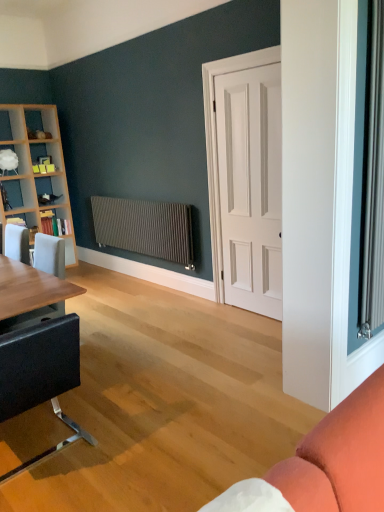
Locate an element on the screen. This screenshot has width=384, height=512. wooden bookshelf at left, arranged as the 2th shelf when viewed from the top is located at coordinates (54, 223).

Describe the element at coordinates (54, 223) in the screenshot. This screenshot has height=512, width=384. I see `wooden bookshelf at left, which is counted as the second shelf, starting from the bottom` at that location.

Where is `matte metallic radiator at center`? This screenshot has width=384, height=512. matte metallic radiator at center is located at coordinates (145, 228).

What do you see at coordinates (145, 228) in the screenshot?
I see `matte metallic radiator at center` at bounding box center [145, 228].

The width and height of the screenshot is (384, 512). Identify the location of wooden bookshelf at left, the first shelf in the bottom-to-top sequence. (23, 225).

Identify the location of wooden bookshelf at left, which is counted as the second shelf, starting from the bottom. (54, 223).

Find the location of a particular element. The image size is (384, 512). the 1st shelf behind the matte black table at left, counting from the anchor's position is located at coordinates click(x=12, y=160).

Considering the relative positions of matte black table at left and white glossy shelf at upper left, which appears as the 1th shelf when viewed from the top, in the image provided, is matte black table at left to the right of white glossy shelf at upper left, which appears as the 1th shelf when viewed from the top, from the viewer's perspective?

Yes, matte black table at left is to the right of white glossy shelf at upper left, which appears as the 1th shelf when viewed from the top.

What's the angular difference between matte black table at left and white glossy shelf at upper left, which is the third shelf in bottom-to-top order,'s facing directions?

The angle between the facing direction of matte black table at left and the facing direction of white glossy shelf at upper left, which is the third shelf in bottom-to-top order, is 87.2 degrees.

Considering the sizes of objects matte black table at left and white glossy shelf at upper left, which is the third shelf in bottom-to-top order, in the image provided, who is shorter, matte black table at left or white glossy shelf at upper left, which is the third shelf in bottom-to-top order,?

white glossy shelf at upper left, which is the third shelf in bottom-to-top order.

Where is `studio couch on the right of wooden bookshelf at left, arranged as the 2th shelf when viewed from the top`? The width and height of the screenshot is (384, 512). studio couch on the right of wooden bookshelf at left, arranged as the 2th shelf when viewed from the top is located at coordinates (325, 464).

How far apart are wooden bookshelf at left, arranged as the 2th shelf when viewed from the top, and matte coral fabric couch at lower right?

A distance of 4.29 meters exists between wooden bookshelf at left, arranged as the 2th shelf when viewed from the top, and matte coral fabric couch at lower right.

From a real-world perspective, is wooden bookshelf at left, arranged as the 2th shelf when viewed from the top, on top of matte coral fabric couch at lower right?

Correct, in the physical world, wooden bookshelf at left, arranged as the 2th shelf when viewed from the top, is higher than matte coral fabric couch at lower right.

Are wooden bookshelf at left, which is counted as the second shelf, starting from the bottom, and matte coral fabric couch at lower right far apart?

Yes, wooden bookshelf at left, which is counted as the second shelf, starting from the bottom, is far from matte coral fabric couch at lower right.

Which is correct: white glossy shelf at upper left, which appears as the 1th shelf when viewed from the top, is inside matte metallic radiator at center, or outside of it?

white glossy shelf at upper left, which appears as the 1th shelf when viewed from the top, is not enclosed by matte metallic radiator at center.

Locate an element on the screen. radiator below the white glossy shelf at upper left, which is the third shelf in bottom-to-top order (from a real-world perspective) is located at coordinates tap(145, 228).

Measure the distance from white glossy shelf at upper left, which appears as the 1th shelf when viewed from the top, to matte metallic radiator at center.

They are 5.09 feet apart.

Looking at the image, does matte coral fabric couch at lower right seem bigger or smaller compared to wooden bookshelf at left, which is the third shelf in top-to-bottom order?

In the image, matte coral fabric couch at lower right appears to be larger than wooden bookshelf at left, which is the third shelf in top-to-bottom order.

Is the surface of matte coral fabric couch at lower right in direct contact with wooden bookshelf at left, which is the third shelf in top-to-bottom order?

matte coral fabric couch at lower right and wooden bookshelf at left, which is the third shelf in top-to-bottom order, are clearly separated.

Is matte coral fabric couch at lower right inside or outside of wooden bookshelf at left, the first shelf in the bottom-to-top sequence?

matte coral fabric couch at lower right lies outside wooden bookshelf at left, the first shelf in the bottom-to-top sequence.

How different are the orientations of matte coral fabric couch at lower right and wooden bookshelf at left, which is the third shelf in top-to-bottom order, in degrees?

179 degrees.

Considering the relative positions of wooden bookshelf at left, the first shelf in the bottom-to-top sequence, and wooden bookshelf at left, which is counted as the second shelf, starting from the bottom, in the image provided, is wooden bookshelf at left, the first shelf in the bottom-to-top sequence, behind wooden bookshelf at left, which is counted as the second shelf, starting from the bottom,?

That is False.

What's the angular difference between wooden bookshelf at left, the first shelf in the bottom-to-top sequence, and wooden bookshelf at left, which is counted as the second shelf, starting from the bottom,'s facing directions?

There is a 3.2-degree angle between the facing directions of wooden bookshelf at left, the first shelf in the bottom-to-top sequence, and wooden bookshelf at left, which is counted as the second shelf, starting from the bottom.

Is wooden bookshelf at left, which is the third shelf in top-to-bottom order, spatially inside wooden bookshelf at left, arranged as the 2th shelf when viewed from the top, or outside of it?

wooden bookshelf at left, which is the third shelf in top-to-bottom order, is not enclosed by wooden bookshelf at left, arranged as the 2th shelf when viewed from the top.

Is matte coral fabric couch at lower right not within black leather chair at lower left?

matte coral fabric couch at lower right is positioned outside black leather chair at lower left.

Between matte coral fabric couch at lower right and black leather chair at lower left, which one has smaller size?

matte coral fabric couch at lower right.

Could you tell me if matte coral fabric couch at lower right is facing black leather chair at lower left?

No, matte coral fabric couch at lower right is not facing towards black leather chair at lower left.

Is matte coral fabric couch at lower right touching black leather chair at lower left?

No.

Between black leather chair at lower left and matte coral fabric couch at lower right, which one has more height?

Standing taller between the two is black leather chair at lower left.

From a real-world perspective, between black leather chair at lower left and matte coral fabric couch at lower right, who is vertically lower?

In real-world perspective, matte coral fabric couch at lower right is lower.

Which point is more forward, (58, 389) or (369, 394)?

The point (369, 394) is closer.

Which shelf is the 1st one when counting from the back of the matte black table at left? Please provide its 2D coordinates.

[(12, 160)]

Locate an element on the screen. the 2nd shelf positioned above the matte coral fabric couch at lower right (from the image's perspective) is located at coordinates (54, 223).

Considering their positions, is black leather chair at lower left positioned further to wooden bookshelf at left, which is counted as the second shelf, starting from the bottom, than matte metallic radiator at center?

Among the two, black leather chair at lower left is located further to wooden bookshelf at left, which is counted as the second shelf, starting from the bottom.

Based on their spatial positions, is matte black table at left or matte metallic radiator at center closer to white glossy shelf at upper left, which appears as the 1th shelf when viewed from the top?

The object closer to white glossy shelf at upper left, which appears as the 1th shelf when viewed from the top, is matte metallic radiator at center.

Looking at the image, which one is located further to matte metallic radiator at center, white matte door at center or wooden bookshelf at left, the first shelf in the bottom-to-top sequence?

wooden bookshelf at left, the first shelf in the bottom-to-top sequence, is further to matte metallic radiator at center.

Based on their spatial positions, is white matte door at center or black leather chair at lower left further from matte coral fabric couch at lower right?

Among the two, white matte door at center is located further to matte coral fabric couch at lower right.

Estimate the real-world distances between objects in this image. Which object is closer to white glossy shelf at upper left, which is the third shelf in bottom-to-top order, matte coral fabric couch at lower right or matte black table at left?

Based on the image, matte black table at left appears to be nearer to white glossy shelf at upper left, which is the third shelf in bottom-to-top order.

Looking at the image, which one is located closer to wooden bookshelf at left, which is counted as the second shelf, starting from the bottom, matte metallic radiator at center or white matte door at center?

Among the two, matte metallic radiator at center is located nearer to wooden bookshelf at left, which is counted as the second shelf, starting from the bottom.

Based on their spatial positions, is black leather chair at lower left or white matte door at center closer to white glossy shelf at upper left, which appears as the 1th shelf when viewed from the top?

Among the two, white matte door at center is located nearer to white glossy shelf at upper left, which appears as the 1th shelf when viewed from the top.

Estimate the real-world distances between objects in this image. Which object is closer to wooden bookshelf at left, the first shelf in the bottom-to-top sequence, matte black table at left or matte metallic radiator at center?

Based on the image, matte black table at left appears to be nearer to wooden bookshelf at left, the first shelf in the bottom-to-top sequence.

Locate an element on the screen. radiator positioned between black leather chair at lower left and white glossy shelf at upper left, which is the third shelf in bottom-to-top order, from near to far is located at coordinates (145, 228).

Where is `table between matte coral fabric couch at lower right and matte metallic radiator at center in the front-back direction`? table between matte coral fabric couch at lower right and matte metallic radiator at center in the front-back direction is located at coordinates (30, 295).

The width and height of the screenshot is (384, 512). Identify the location of shelf located between black leather chair at lower left and wooden bookshelf at left, the first shelf in the bottom-to-top sequence, in the depth direction. (12, 160).

Image resolution: width=384 pixels, height=512 pixels. Find the location of `table between black leather chair at lower left and white glossy shelf at upper left, which is the third shelf in bottom-to-top order, along the z-axis`. table between black leather chair at lower left and white glossy shelf at upper left, which is the third shelf in bottom-to-top order, along the z-axis is located at coordinates (30, 295).